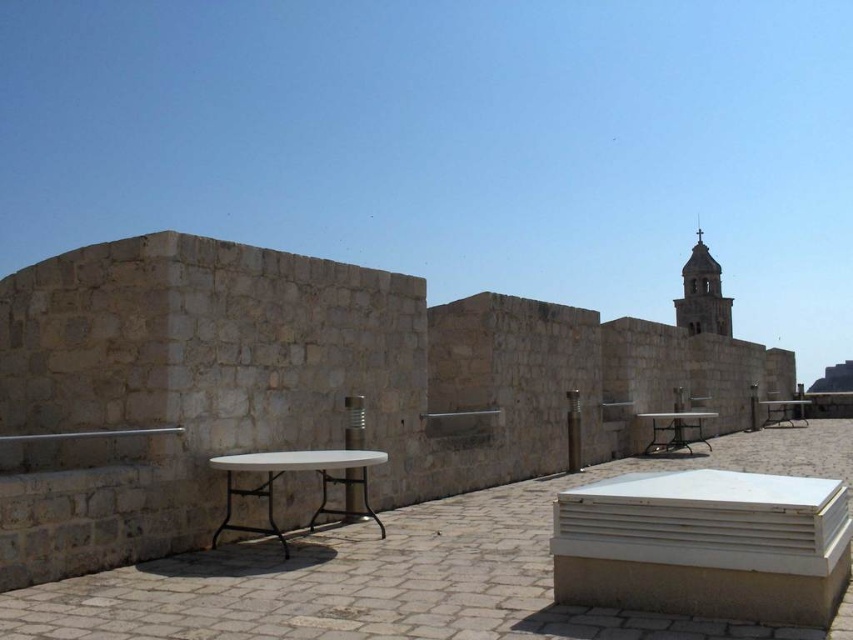
In the scene shown: Can you confirm if white metal table at center is wider than metallic silver chair at center-right?

Correct, the width of white metal table at center exceeds that of metallic silver chair at center-right.

Is white metal table at center below metallic silver chair at center-right?

Indeed, white metal table at center is positioned under metallic silver chair at center-right.

Locate an element on the screen. Image resolution: width=853 pixels, height=640 pixels. white metal table at center is located at coordinates (784, 412).

Is white plastic table at left thinner than metallic silver table at center?

Yes.

Does white plastic table at left appear under metallic silver table at center?

Actually, white plastic table at left is above metallic silver table at center.

Is point (321, 484) positioned behind point (689, 442)?

No, (321, 484) is closer to viewer.

I want to click on white plastic table at left, so click(x=294, y=470).

Is metallic silver table at center smaller than white metal table at center?

Indeed, metallic silver table at center has a smaller size compared to white metal table at center.

Between point (685, 417) and point (799, 412), which one is positioned in front?

Point (685, 417) is in front.

Locate an element on the screen. The height and width of the screenshot is (640, 853). metallic silver table at center is located at coordinates (675, 429).

Locate an element on the screen. The width and height of the screenshot is (853, 640). metallic silver table at center is located at coordinates (675, 429).